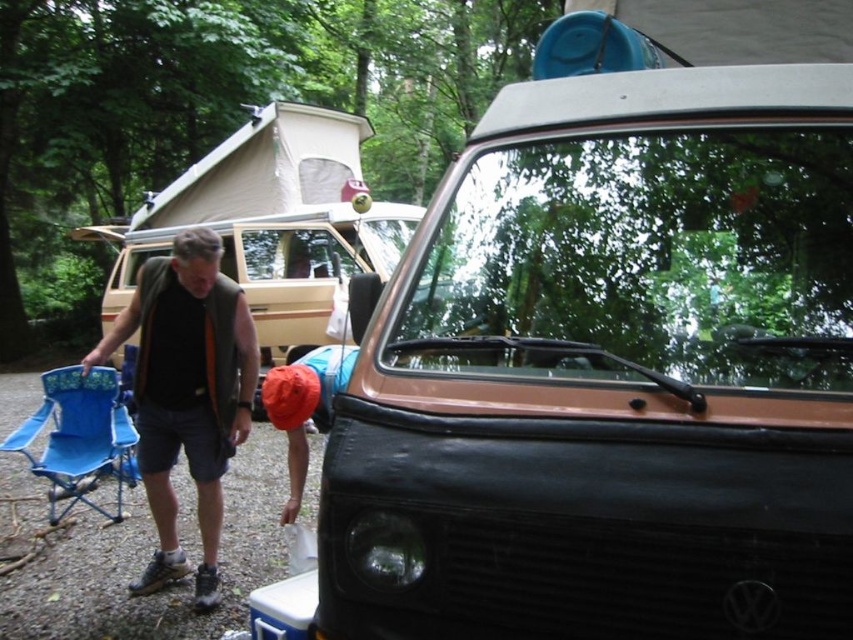
Can you confirm if black matte van at center is positioned below blue fabric folding chair at lower left?

No, black matte van at center is not below blue fabric folding chair at lower left.

Is point (817, 531) closer to viewer compared to point (49, 499)?

That is True.

Is point (834, 548) positioned behind point (48, 413)?

That is False.

This screenshot has width=853, height=640. In order to click on black matte van at center in this screenshot , I will do `click(610, 365)`.

The image size is (853, 640). What do you see at coordinates (186, 394) in the screenshot?
I see `black fabric vest at left` at bounding box center [186, 394].

Does point (144, 339) lie behind point (102, 410)?

No, (144, 339) is in front of (102, 410).

Which is behind, point (143, 468) or point (125, 413)?

Point (125, 413)

You are a GUI agent. You are given a task and a screenshot of the screen. Output one action in this format:
    pyautogui.click(x=<x>, y=<y>)
    Task: Click on the black fabric vest at left
    
    Given the screenshot: What is the action you would take?
    pyautogui.click(x=186, y=394)

Is point (178, 260) less distant than point (286, 253)?

Yes, it is in front of point (286, 253).

Is black fabric vest at left to the left of matte black van at left from the viewer's perspective?

Correct, you'll find black fabric vest at left to the left of matte black van at left.

Is point (158, 552) positioned in front of point (297, 259)?

Yes, it is.

You are a GUI agent. You are given a task and a screenshot of the screen. Output one action in this format:
    pyautogui.click(x=<x>, y=<y>)
    Task: Click on the black fabric vest at left
    This screenshot has width=853, height=640.
    Given the screenshot: What is the action you would take?
    pyautogui.click(x=186, y=394)